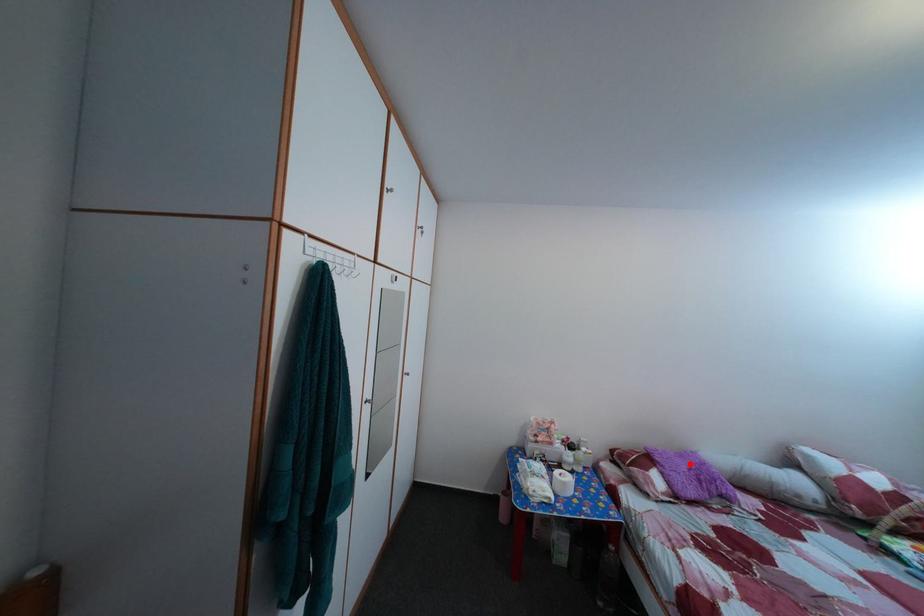
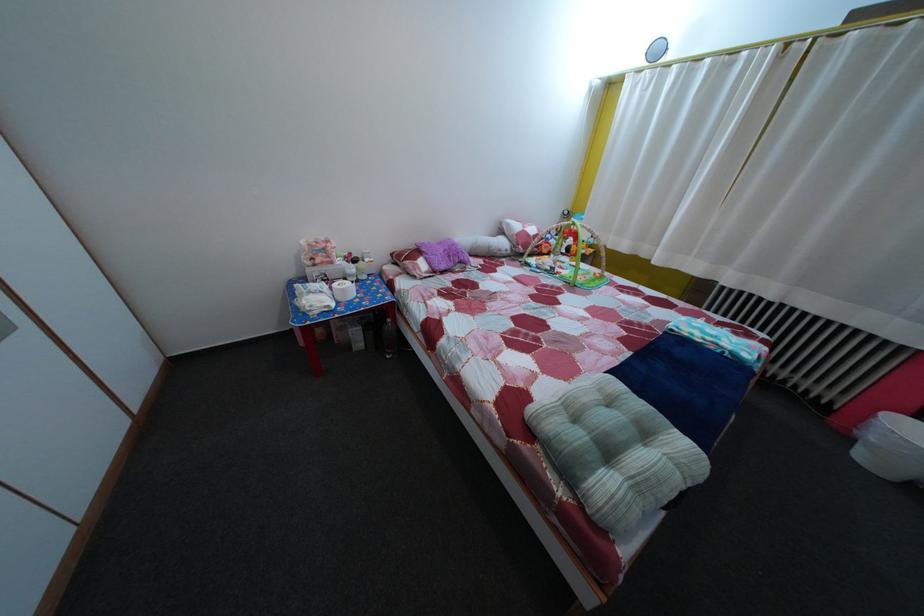
Question: A red point is marked in image1. In image2, is the corresponding 3D point closer to the camera or farther? Reply with the corresponding letter.

Choices:
 (A) The corresponding 3D point is closer.
 (B) The corresponding 3D point is farther.

Answer: (A)